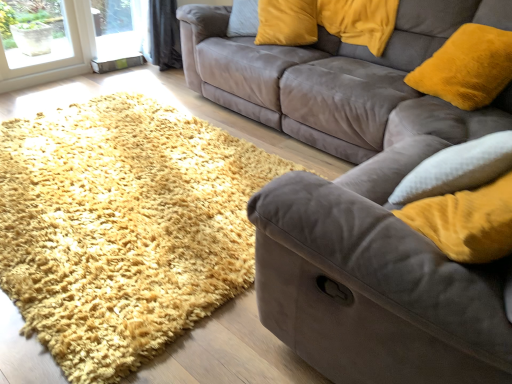
Question: Is velvet yellow pillow at upper right, which appears as the first pillow when viewed from the right, situated inside velvet yellow pillow at upper center, which is counted as the first pillow, starting from the left, or outside?

Choices:
 (A) inside
 (B) outside

Answer: (B)

Question: Visually, is velvet yellow pillow at upper right, which appears as the first pillow when viewed from the right, positioned to the left or to the right of velvet yellow pillow at upper center, which is counted as the first pillow, starting from the left?

Choices:
 (A) right
 (B) left

Answer: (A)

Question: Which is nearer to the shaggy yellow rug at lower left?

Choices:
 (A) suede couch at center, the 1th studio couch from the front
 (B) velvet yellow pillow at upper right, which appears as the first pillow when viewed from the right
 (C) velvet yellow pillow at upper center, which appears as the second pillow when viewed from the right
 (D) velvet gray couch at center, which appears as the 1th studio couch when viewed from the back

Answer: (A)

Question: Which object is positioned closest to the velvet yellow pillow at upper right, which appears as the first pillow when viewed from the right?

Choices:
 (A) velvet gray couch at center, which appears as the 1th studio couch when viewed from the back
 (B) velvet yellow pillow at upper center, which appears as the second pillow when viewed from the right
 (C) suede couch at center, the second studio couch positioned from the back
 (D) shaggy yellow rug at lower left

Answer: (B)